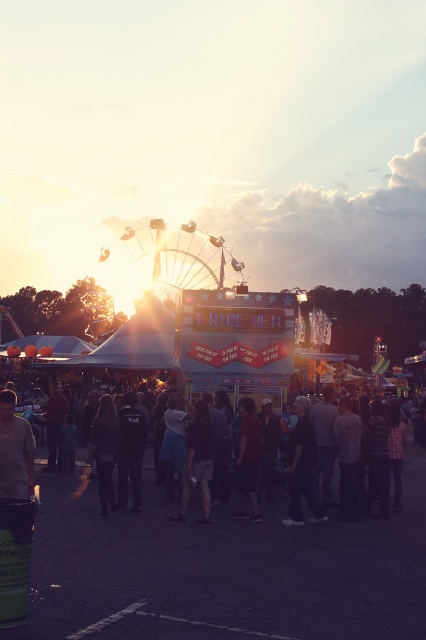
Question: Considering the relative positions of dark gray jacket at center and dark red shirt at center in the image provided, where is dark gray jacket at center located with respect to dark red shirt at center?

Choices:
 (A) right
 (B) left

Answer: (A)

Question: Considering the real-world distances, which object is closest to the dark red shirt at center?

Choices:
 (A) dark gray jacket at center
 (B) dark gray casual clothing at center

Answer: (A)

Question: Can you confirm if dark gray casual clothing at center is thinner than dark gray jacket at center?

Choices:
 (A) yes
 (B) no

Answer: (B)

Question: Can you confirm if dark gray casual clothing at center is wider than dark red shirt at center?

Choices:
 (A) no
 (B) yes

Answer: (B)

Question: Which object is the closest to the dark red shirt at center?

Choices:
 (A) dark gray casual clothing at center
 (B) dark gray jacket at center

Answer: (B)

Question: Which object is the farthest from the dark gray jacket at center?

Choices:
 (A) dark red shirt at center
 (B) dark gray casual clothing at center

Answer: (B)